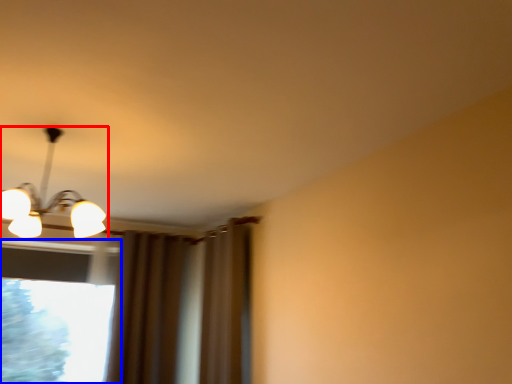
Question: Which of the following is the farthest to the observer, lamp (highlighted by a red box) or window (highlighted by a blue box)?

Choices:
 (A) lamp
 (B) window

Answer: (B)